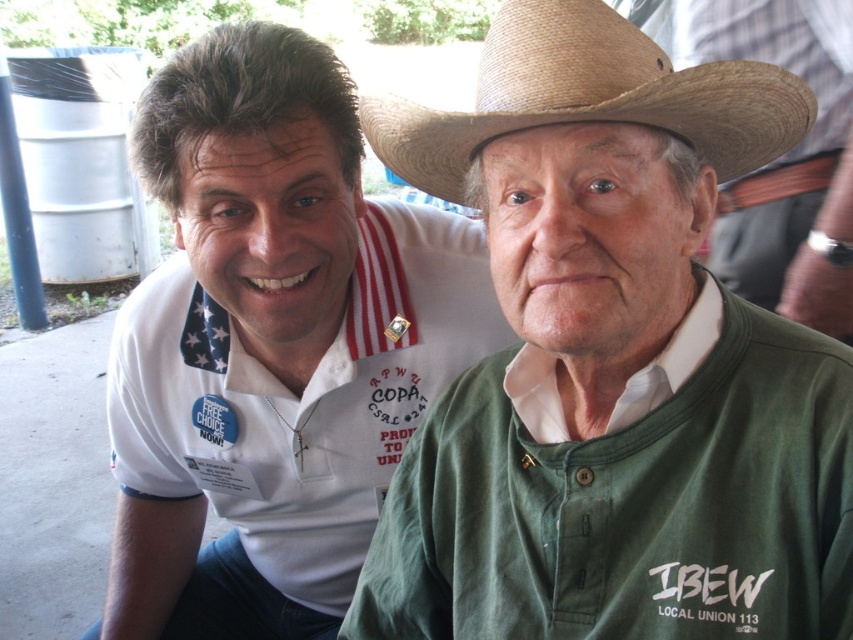
Question: Which of these objects is positioned closest to the white cotton polo shirt at left?

Choices:
 (A) braided straw cowboy hat at upper center
 (B) green cotton shirt at center

Answer: (B)

Question: Where is white cotton polo shirt at left located in relation to braided straw cowboy hat at upper center in the image?

Choices:
 (A) above
 (B) below

Answer: (B)

Question: Can you confirm if green cotton shirt at center is positioned below braided straw cowboy hat at upper center?

Choices:
 (A) yes
 (B) no

Answer: (A)

Question: Is white cotton polo shirt at left wider than braided straw cowboy hat at upper center?

Choices:
 (A) yes
 (B) no

Answer: (A)

Question: Estimate the real-world distances between objects in this image. Which object is farther from the white cotton polo shirt at left?

Choices:
 (A) braided straw cowboy hat at upper center
 (B) green cotton shirt at center

Answer: (A)

Question: Which object appears closest to the camera in this image?

Choices:
 (A) green cotton shirt at center
 (B) braided straw cowboy hat at upper center

Answer: (B)